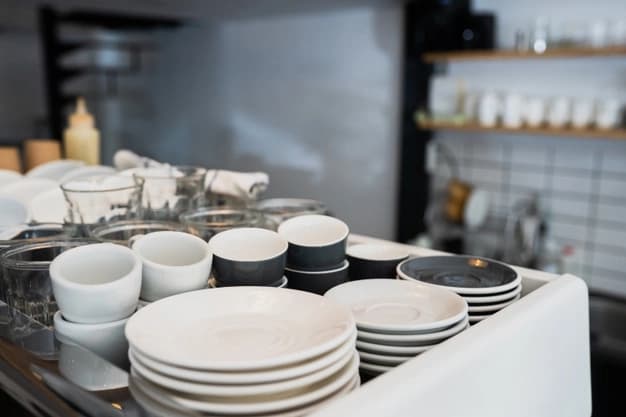
Locate an element on the screen. Image resolution: width=626 pixels, height=417 pixels. coffee cup is located at coordinates (86, 288), (96, 334), (172, 266), (145, 301).